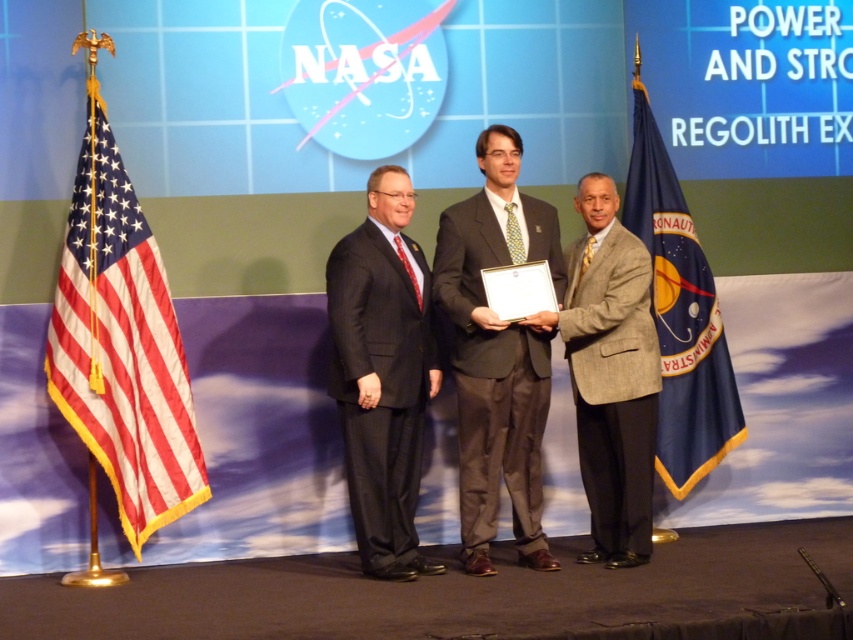
Does matte gray suit at center have a greater height compared to dark gray suit at center?

Correct, matte gray suit at center is much taller as dark gray suit at center.

Is matte gray suit at center to the right of dark gray suit at center from the viewer's perspective?

Indeed, matte gray suit at center is positioned on the right side of dark gray suit at center.

Measure the distance between matte gray suit at center and camera.

matte gray suit at center is 15.29 feet away from camera.

The width and height of the screenshot is (853, 640). I want to click on matte gray suit at center, so click(497, 353).

Is dark gray suit at center wider than light brown textured suit at center?

Incorrect, dark gray suit at center's width does not surpass light brown textured suit at center's.

Is dark gray suit at center behind light brown textured suit at center?

No.

The image size is (853, 640). What do you see at coordinates (381, 372) in the screenshot?
I see `dark gray suit at center` at bounding box center [381, 372].

I want to click on dark gray suit at center, so pos(381,372).

Does light brown textured suit at center have a smaller size compared to blue fabric flag at right?

Correct, light brown textured suit at center occupies less space than blue fabric flag at right.

Does point (595, 264) come behind point (718, 420)?

No, (595, 264) is closer to viewer.

What are the coordinates of `light brown textured suit at center` in the screenshot? It's located at (611, 376).